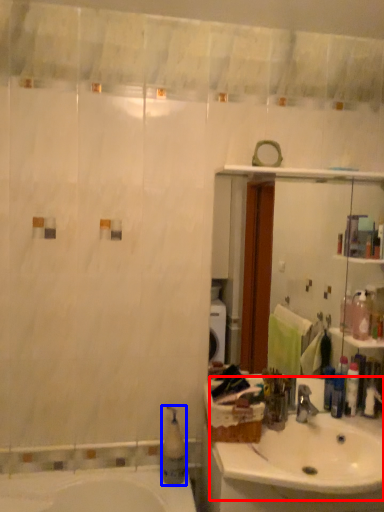
Question: Which point is further to the camera, sink (highlighted by a red box) or soap dispenser (highlighted by a blue box)?

Choices:
 (A) sink
 (B) soap dispenser

Answer: (B)